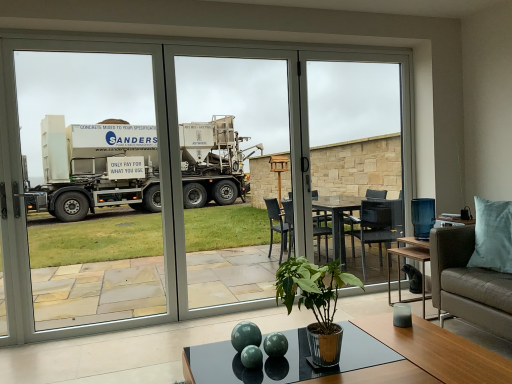
Question: Relative to transparent glass door at center, is transparent glass door at left, the 2th screen door in the right-to-left sequence, in front or behind?

Choices:
 (A) behind
 (B) front

Answer: (A)

Question: In terms of size, does transparent glass door at left, the 2th screen door in the right-to-left sequence, appear bigger or smaller than transparent glass door at center?

Choices:
 (A) big
 (B) small

Answer: (B)

Question: Estimate the real-world distances between objects in this image. Which object is farther from the transparent glass door at center, the second screen door positioned from the left?

Choices:
 (A) transparent glass door at center
 (B) matte black coffee table at center
 (C) brown leather couch at lower right
 (D) transparent glass table at center
 (E) green glossy plant at center

Answer: (B)

Question: Which object is positioned farthest from the green glossy plant at center?

Choices:
 (A) matte black coffee table at center
 (B) brown leather couch at lower right
 (C) transparent glass table at center
 (D) transparent glass door at left, the 2th screen door in the right-to-left sequence
 (E) transparent glass door at center, the second screen door positioned from the left

Answer: (D)